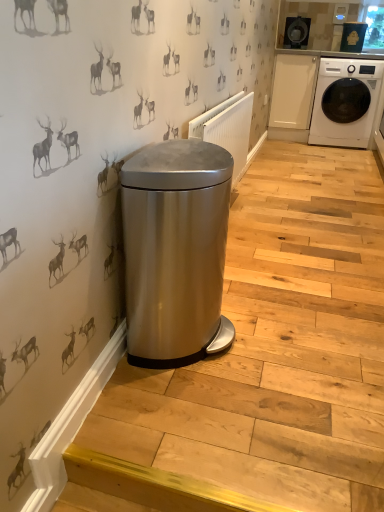
Question: From a real-world perspective, relative to stainless steel trash can at lower left, is white glossy washing machine at right vertically above or below?

Choices:
 (A) below
 (B) above

Answer: (B)

Question: Choose the correct answer: Is white glossy washing machine at right inside stainless steel trash can at lower left or outside it?

Choices:
 (A) outside
 (B) inside

Answer: (A)

Question: Which is farther from the white glossy washing machine at right?

Choices:
 (A) satin silver radiator at center
 (B) satin silver trash can at center
 (C) stainless steel trash can at lower left
 (D) satin silver trash can at center

Answer: (B)

Question: Which of these objects is positioned closest to the satin silver trash can at center?

Choices:
 (A) white glossy washing machine at right
 (B) satin silver trash can at center
 (C) satin silver radiator at center
 (D) stainless steel trash can at lower left

Answer: (B)